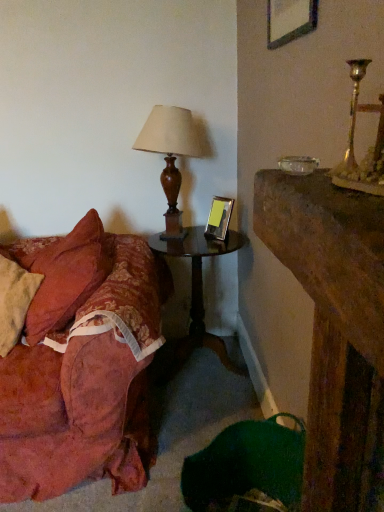
I want to click on blank space to the left of metallic silver picture frame at center, which ranks as the first picture frame in bottom-to-top order, so click(195, 242).